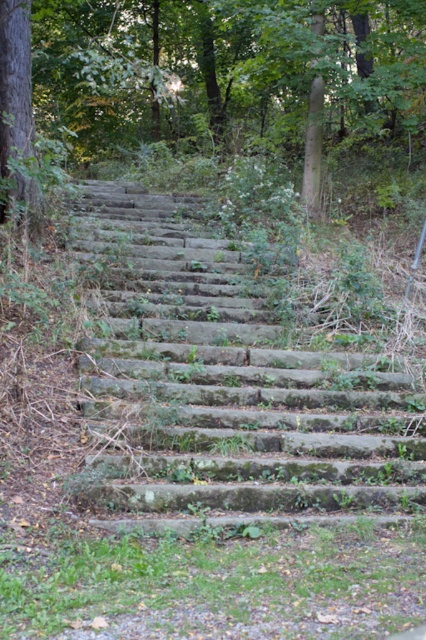
Consider the image. You are a hiker trying to navigate the green mossy stone stairs at center and the green mossy stone steps at center. Which one takes up more space in the image?

The green mossy stone steps at center takes up more space in the image than the green mossy stone stairs at center because the green mossy stone stairs at center occupies less space than green mossy stone steps at center.

You are a hiker carrying a heavy backpack and need to climb the green mossy stone stairs at center and the green mossy stone steps at center. Which path would be easier to navigate considering their widths?

The green mossy stone stairs at center has a narrower width compared to the green mossy stone steps at center. Since you are carrying a heavy backpack, the wider green mossy stone steps at center would provide a more stable and easier path to navigate.

You are standing at the base of the stone steps in the image. A treasure map indicates that a hidden item is located exactly at point (245, 289). Considering the terrain described, can you safely walk straight to that point without obstacles?

The point (245, 289) is 10.04 meters away from the viewer. However, the terrain around the stone steps is uneven with patches of grass, dried leaves, and overgrown plants, which may pose obstacles. Therefore, it might not be safe to walk straight to that point without encountering obstacles.